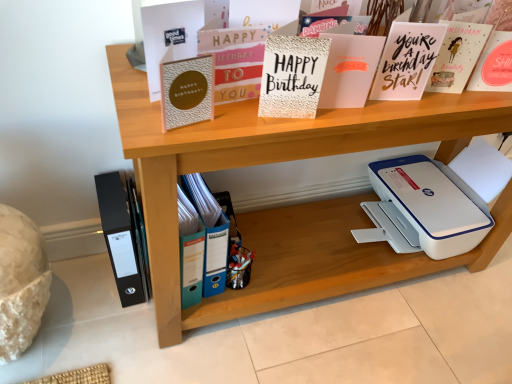
Find the location of `unoccupied area in front of matte gold card at upper center, which appears as the 6th paperback book when viewed from the left`. unoccupied area in front of matte gold card at upper center, which appears as the 6th paperback book when viewed from the left is located at coordinates (385, 115).